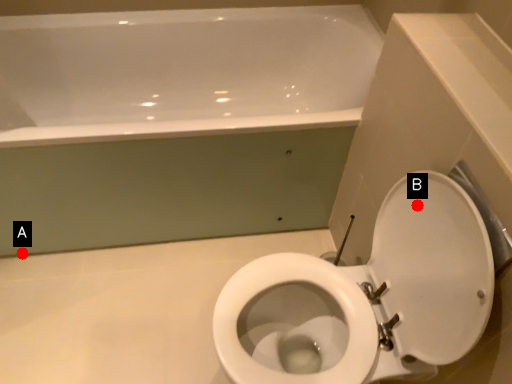
Question: Two points are circled on the image, labeled by A and B beside each circle. Which point appears closest to the camera in this image?

Choices:
 (A) A is closer
 (B) B is closer

Answer: (B)